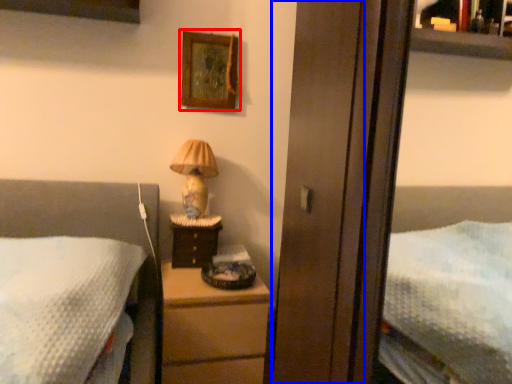
Question: Which object appears closest to the camera in this image, picture frame (highlighted by a red box) or screen door (highlighted by a blue box)?

Choices:
 (A) picture frame
 (B) screen door

Answer: (B)